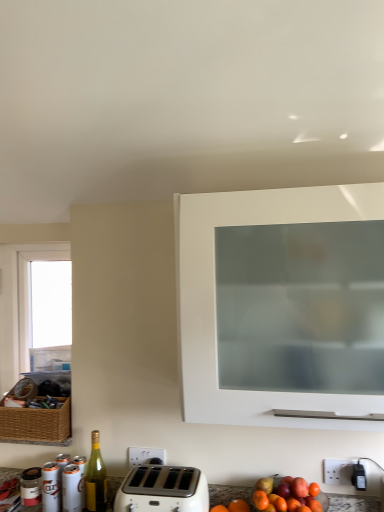
Question: From the image's perspective, relative to green glass bottle at lower left, is transparent glass window at left above or below?

Choices:
 (A) below
 (B) above

Answer: (B)

Question: Which is correct: transparent glass window at left is inside green glass bottle at lower left, or outside of it?

Choices:
 (A) inside
 (B) outside

Answer: (B)

Question: Based on their relative distances, which object is nearer to the white plastic toaster at lower center?

Choices:
 (A) transparent glass window at left
 (B) white glossy cabinet at upper center
 (C) green glass bottle at lower left

Answer: (C)

Question: Which of these objects is positioned farthest from the transparent glass window at left?

Choices:
 (A) white glossy cabinet at upper center
 (B) green glass bottle at lower left
 (C) white plastic toaster at lower center

Answer: (A)